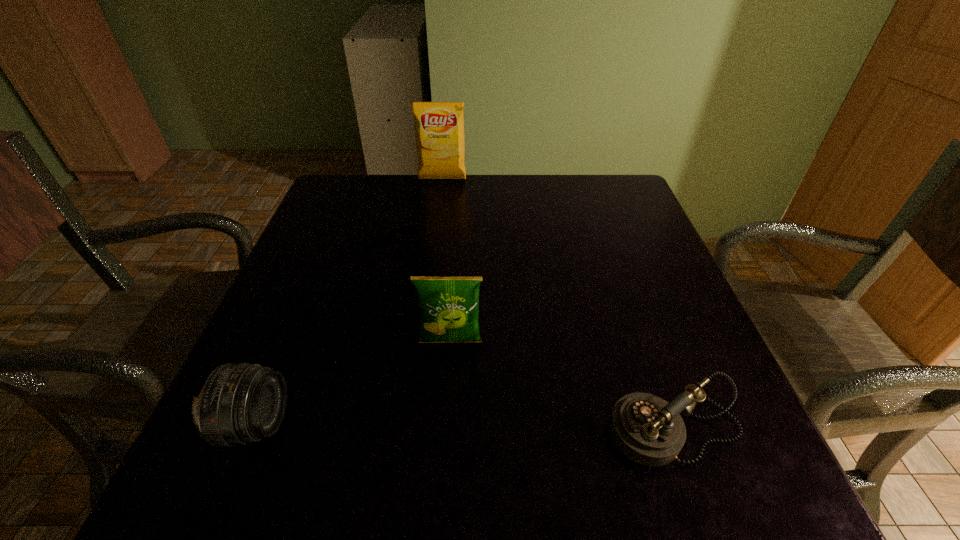
At what (x,y) coordinates should I click in order to perform the action: click on vacant space at the right edge of the desktop. Please return your answer as a coordinate pair (x, y). Image resolution: width=960 pixels, height=540 pixels. Looking at the image, I should click on (680, 370).

Image resolution: width=960 pixels, height=540 pixels. Identify the location of vacant region at the far left corner of the desktop. (378, 220).

Find the location of `free space at the near left corner of the desktop`. free space at the near left corner of the desktop is located at coordinates (303, 457).

The image size is (960, 540). I want to click on free space at the far right corner of the desktop, so click(x=604, y=176).

At what (x,y) coordinates should I click in order to perform the action: click on free region at the near right corner of the desktop. Please return your answer as a coordinate pair (x, y). The image size is (960, 540). Looking at the image, I should click on (693, 463).

This screenshot has width=960, height=540. I want to click on free area in between the rightmost object and the leftmost object, so click(x=466, y=427).

I want to click on free area in between the second farthest object and the farther crisp (potato chip), so click(446, 261).

Find the location of a particular element. The width and height of the screenshot is (960, 540). free space between the second farthest object and the farther crisp (potato chip) is located at coordinates (446, 261).

At what (x,y) coordinates should I click in order to perform the action: click on unoccupied position between the third shortest object and the taller crisp (potato chip). Please return your answer as a coordinate pair (x, y). This screenshot has width=960, height=540. Looking at the image, I should click on (446, 261).

Find the location of `free space that is in between the leftmost object and the tallest object`. free space that is in between the leftmost object and the tallest object is located at coordinates (348, 302).